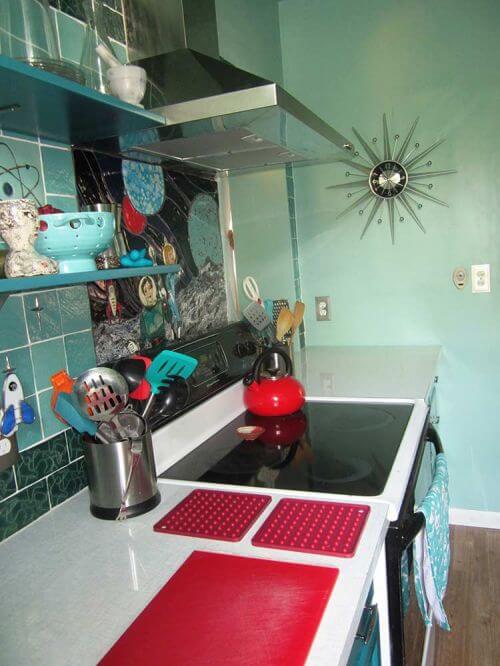
Find the location of `clock`. clock is located at coordinates (387, 184).